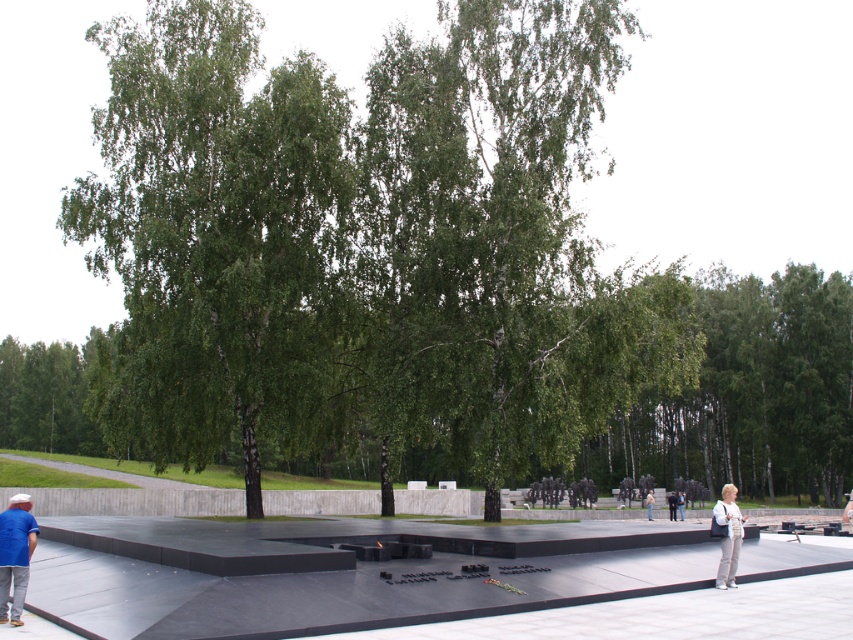
You are standing at the memorial site and want to take a photo of the green leafy tree at center and the dark gray pants at lower right. Which object should you focus on first if you want to capture both in a single frame without moving the camera?

The green leafy tree at center is wider than the dark gray pants at lower right, so you should focus on the green leafy tree at center first to ensure it fits within the frame.

You are standing at the memorial site and want to take a photo of the dark gray pants at lower right. Where should you position yourself to capture it in the frame?

To capture the dark gray pants at lower right in your photo, position yourself at the point specified by the coordinates provided in the description, which is at point (x=672, y=506).